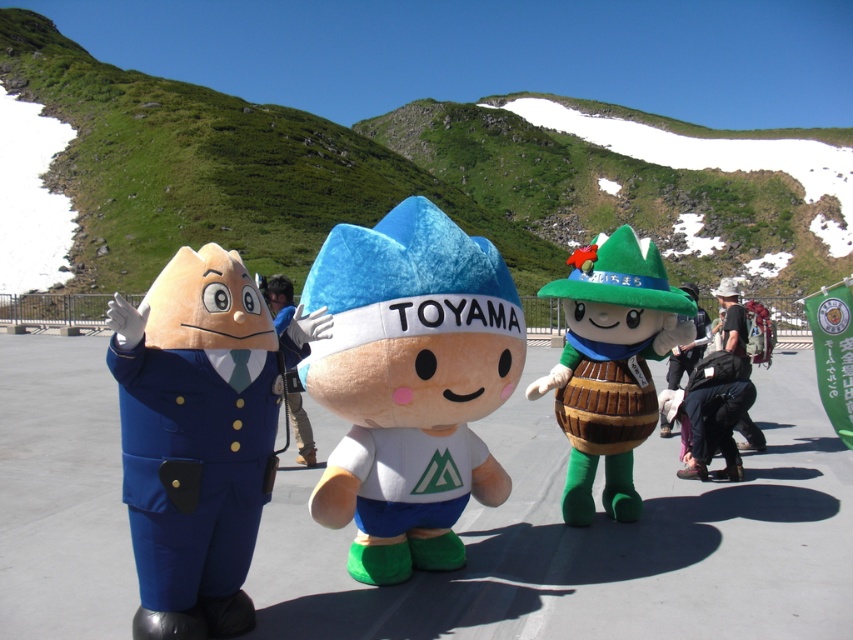
Question: Which of the following is the farthest from the observer?

Choices:
 (A) tap(683, 289)
 (B) tap(273, 285)

Answer: (A)

Question: Can you confirm if green felt hat at center is bigger than green felt hat at right?

Choices:
 (A) yes
 (B) no

Answer: (A)

Question: Which point is farther to the camera?

Choices:
 (A) fluffy blue plush toy at center
 (B) green felt hat at right

Answer: (B)

Question: Where is matte blue uniform at left located in relation to green felt hat at center in the image?

Choices:
 (A) above
 (B) below

Answer: (B)

Question: Can you confirm if dark gray backpack at center right is positioned below green felt hat at right?

Choices:
 (A) no
 (B) yes

Answer: (B)

Question: Which point appears closest to the camera in this image?

Choices:
 (A) (274, 307)
 (B) (352, 410)
 (C) (660, 275)
 (D) (169, 552)

Answer: (D)